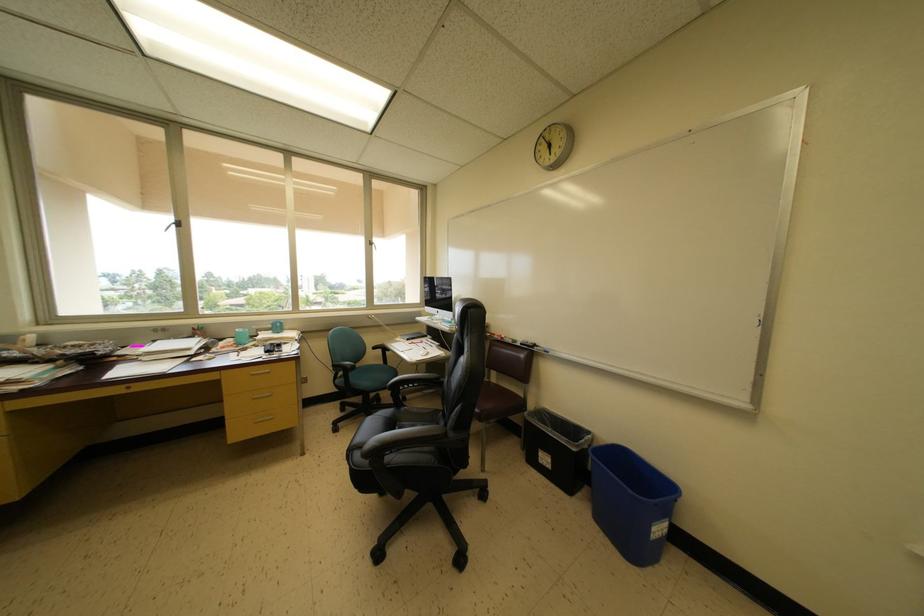
Where would you lift the whiteboard marker? Please return your answer as a coordinate pair (x, y).

(516, 342)